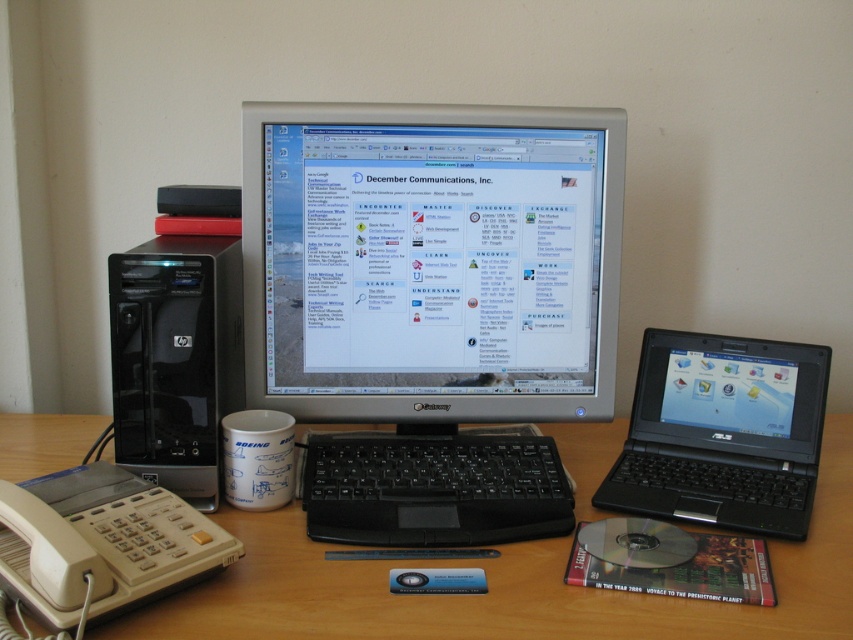
Measure the distance between black plastic laptop at right and black plastic computer tower at left.

The distance of black plastic laptop at right from black plastic computer tower at left is 20.29 inches.

Can you confirm if black plastic laptop at right is thinner than black plastic computer tower at left?

In fact, black plastic laptop at right might be wider than black plastic computer tower at left.

Does point (709, 369) come in front of point (177, 420)?

No.

Where is `black plastic laptop at right`? This screenshot has height=640, width=853. black plastic laptop at right is located at coordinates (722, 433).

Can you confirm if silver/black plastic monitor at center is taller than black plastic computer tower at left?

Yes.

Where is `silver/black plastic monitor at center`? This screenshot has height=640, width=853. silver/black plastic monitor at center is located at coordinates (431, 260).

Locate an element on the screen. Image resolution: width=853 pixels, height=640 pixels. silver/black plastic monitor at center is located at coordinates (431, 260).

Who is positioned more to the left, silver/black plastic monitor at center or black plastic keyboard at center?

black plastic keyboard at center is more to the left.

Who is more distant from viewer, (349,147) or (358,540)?

Point (349,147)

Between point (524, 339) and point (480, 484), which one is positioned behind?

The point (524, 339) is more distant.

I want to click on silver/black plastic monitor at center, so click(x=431, y=260).